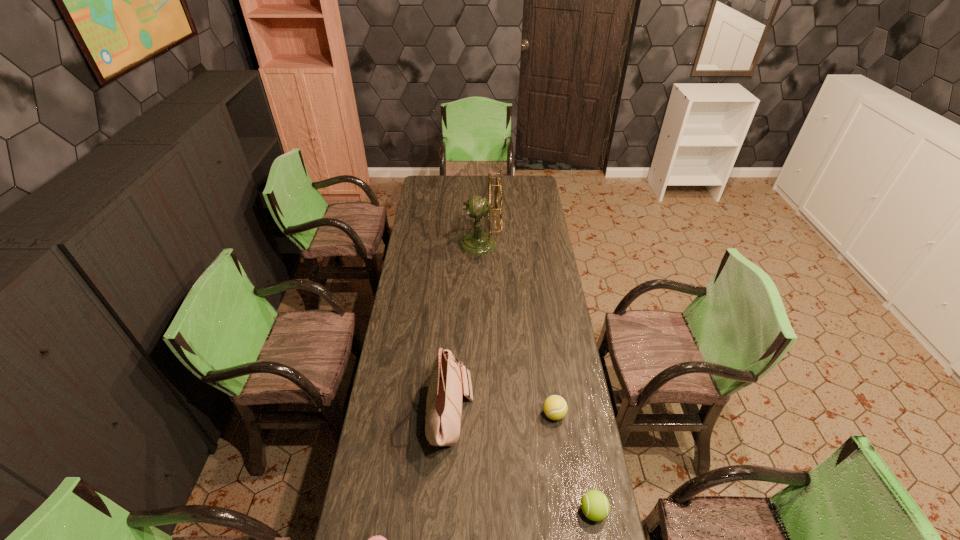
Locate an element on the screen. This screenshot has height=540, width=960. object that stands as the third closest to the second nearest object is located at coordinates (378, 539).

Where is `free point that satisfies the following two spatial constraints: 1. in front of the fan, directing air flow; 2. on the left side of the second nearest object`? This screenshot has width=960, height=540. free point that satisfies the following two spatial constraints: 1. in front of the fan, directing air flow; 2. on the left side of the second nearest object is located at coordinates coord(480,511).

Locate an element on the screen. vacant space that satisfies the following two spatial constraints: 1. in front of the farthest object, directing air flow; 2. on the back side of the nearer tennis ball is located at coordinates (480, 511).

Find the location of a particular element. The image size is (960, 540). vacant space that satisfies the following two spatial constraints: 1. on the side of the second tallest object with the attached pouch; 2. on the right side of the nearer tennis ball is located at coordinates 445,511.

The width and height of the screenshot is (960, 540). Identify the location of free location that satisfies the following two spatial constraints: 1. on the back side of the nearer tennis ball; 2. on the side of the fourth shortest object with the attached pouch. (575, 413).

Locate an element on the screen. vacant region that satisfies the following two spatial constraints: 1. on the side of the fourth shortest object with the attached pouch; 2. on the back side of the nearer tennis ball is located at coordinates (445, 511).

Find the location of a particular element. vacant region that satisfies the following two spatial constraints: 1. in front of the fan, directing air flow; 2. on the right side of the farther tennis ball is located at coordinates (480, 414).

This screenshot has height=540, width=960. I want to click on free space that satisfies the following two spatial constraints: 1. on the side of the fourth shortest object with the attached pouch; 2. on the left side of the farther tennis ball, so click(450, 414).